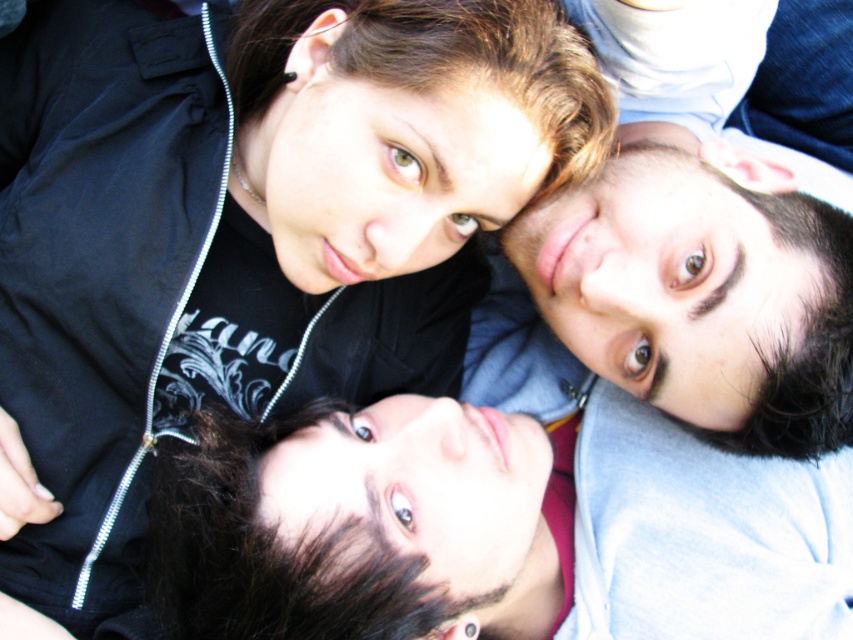
Based on the photo, looking at the three people in the image, you notice two faces labeled as smooth skin face at center and smooth skin face at upper right. Which of these two faces has a wider appearance?

The smooth skin face at center has a wider appearance than the smooth skin face at upper right.

In the scene, there are a black matte jacket at upper left and a smooth skin face at center. Which object is positioned to the left of the other?

The black matte jacket at upper left is to the left of the smooth skin face at center.

You are standing in front of the black matte jacket at upper left and want to reach into your pocket which is 0.5 meters away from you. Can you do this without moving your position?

The black matte jacket at upper left and viewer are 1.01 meters apart from each other, so you can reach into your pocket which is 0.5 meters away from you without moving your position because the distance between you and the jacket is greater than the reach distance.